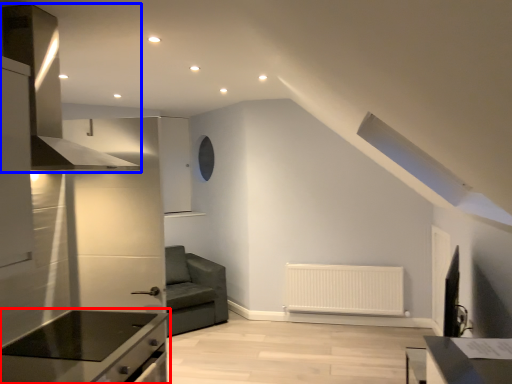
Question: Which object appears farthest to the camera in this image, countertop (highlighted by a red box) or exhaust hood (highlighted by a blue box)?

Choices:
 (A) countertop
 (B) exhaust hood

Answer: (A)